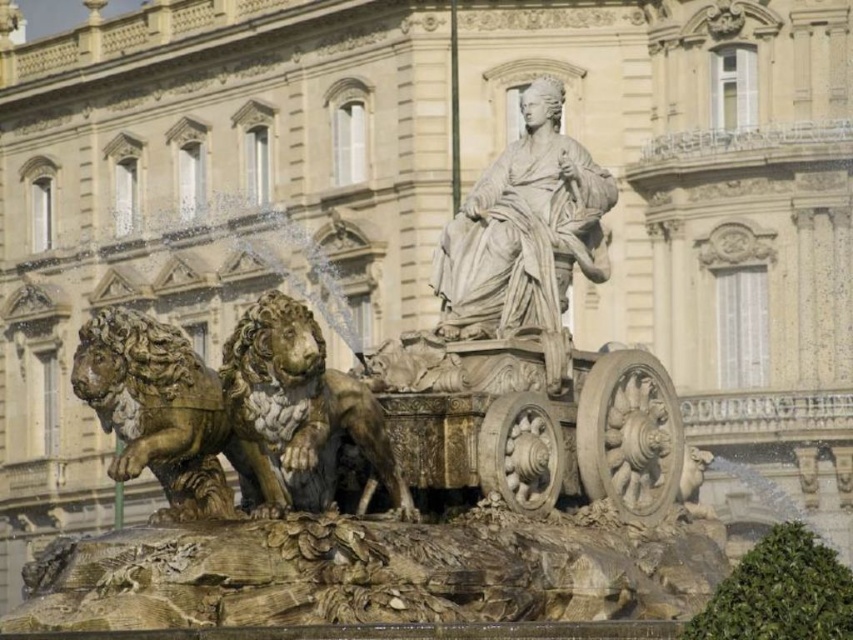
Is point (260, 513) farther from camera compared to point (287, 492)?

No, (260, 513) is closer to viewer.

Does point (192, 388) lie in front of point (247, 476)?

Yes, point (192, 388) is in front of point (247, 476).

Locate an element on the screen. The width and height of the screenshot is (853, 640). gold polished stone lion at lower left is located at coordinates (167, 416).